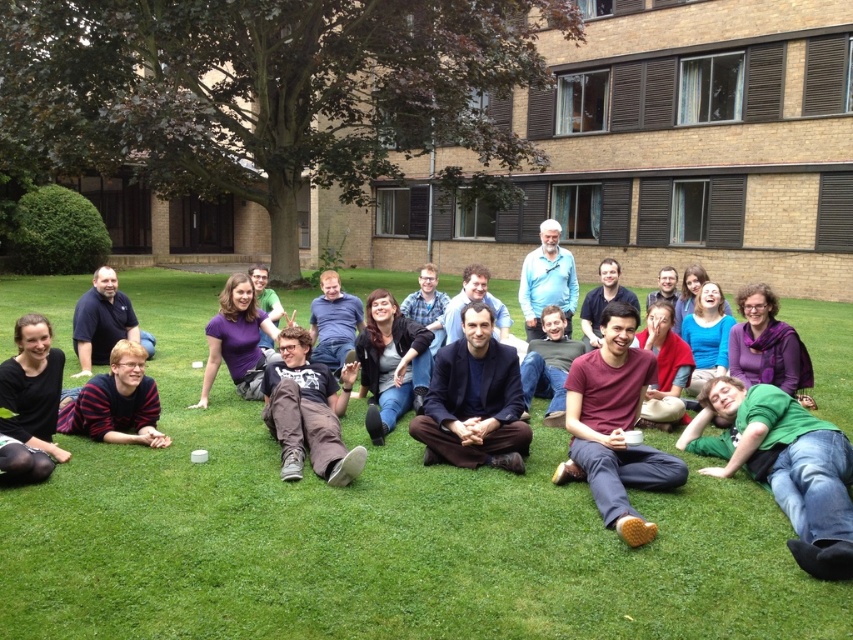
Question: Can you confirm if matte black hair at lower left is smaller than striped sweater at lower left?

Choices:
 (A) no
 (B) yes

Answer: (A)

Question: Considering the relative positions of green cotton shirt at lower right and brown suede jacket at center in the image provided, where is green cotton shirt at lower right located with respect to brown suede jacket at center?

Choices:
 (A) below
 (B) above

Answer: (A)

Question: Considering the real-world distances, which object is closest to the striped sweater at lower left?

Choices:
 (A) green cotton shirt at lower right
 (B) green grass at center

Answer: (B)

Question: Which object appears closest to the camera in this image?

Choices:
 (A) striped sweater at lower left
 (B) dark blue fabric at center
 (C) green cotton shirt at lower right

Answer: (C)

Question: Is green grass at center to the left of maroon cotton shirt at center from the viewer's perspective?

Choices:
 (A) yes
 (B) no

Answer: (A)

Question: Which point is closer to the camera taking this photo?

Choices:
 (A) (102, 298)
 (B) (190, 584)
 (C) (115, 348)
 (D) (450, 432)

Answer: (B)